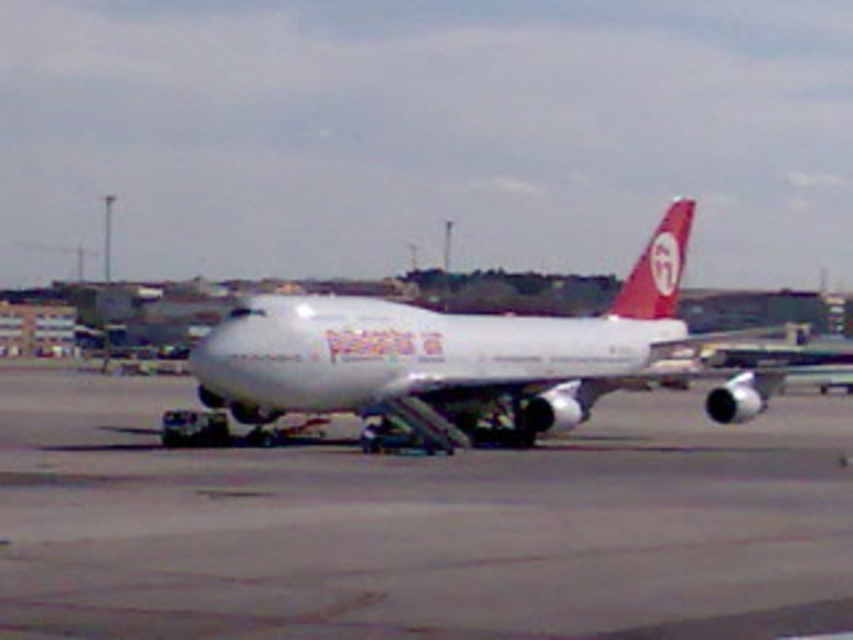
Question: Estimate the real-world distances between objects in this image. Which object is farther from the white glossy airliner at center?

Choices:
 (A) gray concrete runway at center
 (B) matte red airplane tail at upper right

Answer: (B)

Question: Among these points, which one is nearest to the camera?

Choices:
 (A) (633, 280)
 (B) (299, 308)

Answer: (B)

Question: Is white glossy airliner at center positioned behind matte red airplane tail at upper right?

Choices:
 (A) yes
 (B) no

Answer: (B)

Question: In this image, where is gray concrete runway at center located relative to matte red airplane tail at upper right?

Choices:
 (A) below
 (B) above

Answer: (A)

Question: Which of these objects is positioned closest to the gray concrete runway at center?

Choices:
 (A) matte red airplane tail at upper right
 (B) white glossy airliner at center

Answer: (B)

Question: In this image, where is gray concrete runway at center located relative to matte red airplane tail at upper right?

Choices:
 (A) right
 (B) left

Answer: (B)